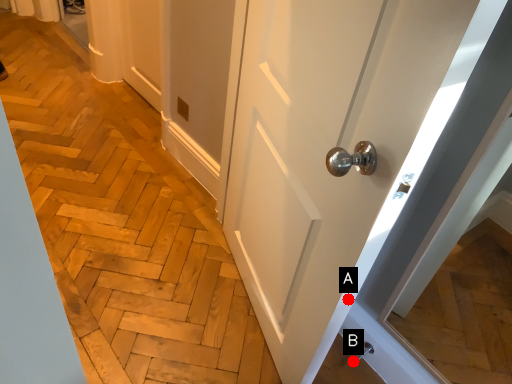
Question: Two points are circled on the image, labeled by A and B beside each circle. Which of the following is the closest to the observer?

Choices:
 (A) A is closer
 (B) B is closer

Answer: (A)